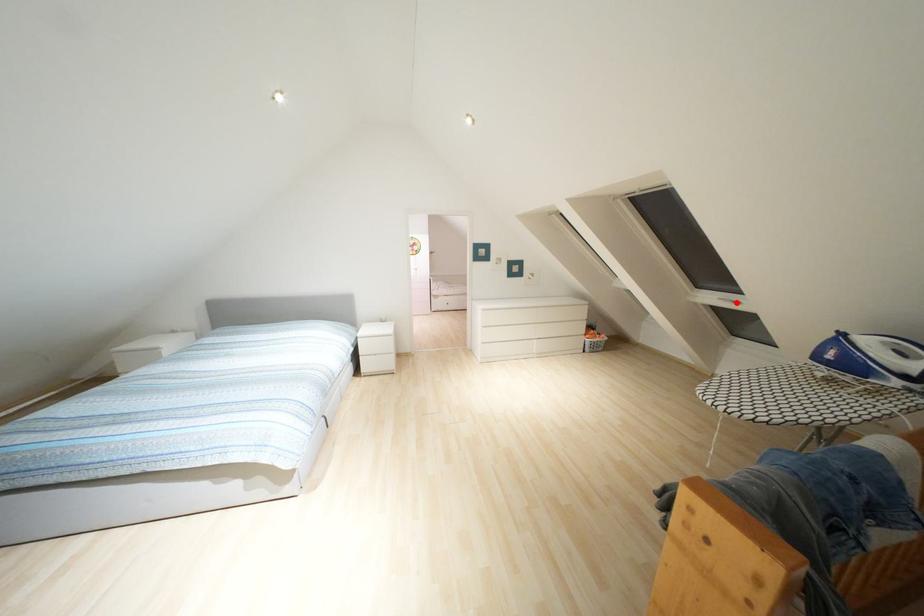
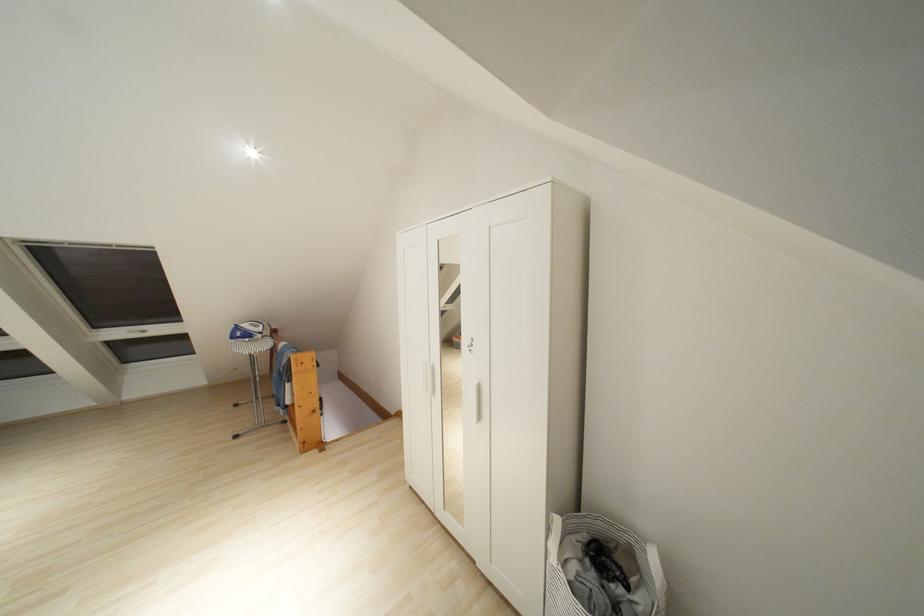
In the second image, find the point that corresponds to the highlighted location in the first image.

(141, 331)